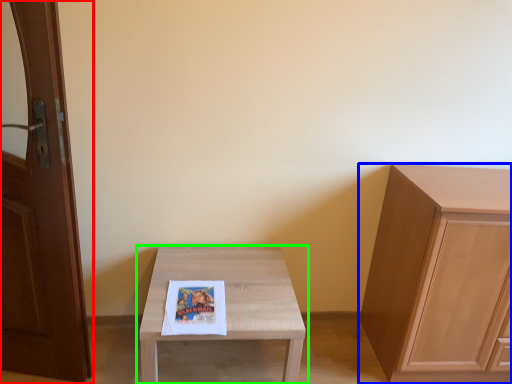
Question: Which object is positioned closest to door (highlighted by a red box)? Select from cabinetry (highlighted by a blue box) and table (highlighted by a green box).

Choices:
 (A) cabinetry
 (B) table

Answer: (B)